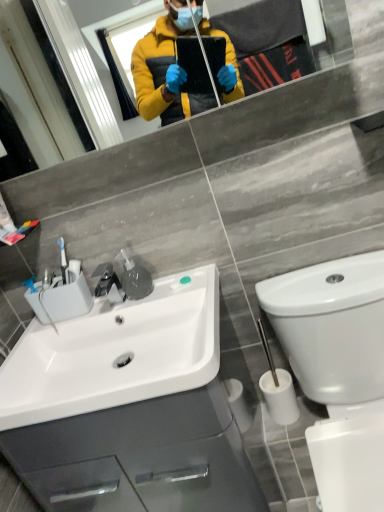
Question: From a real-world perspective, is white glossy toilet at lower right physically below white glossy sink at lower left?

Choices:
 (A) no
 (B) yes

Answer: (B)

Question: From a real-world perspective, is white glossy toilet at lower right positioned over white glossy sink at lower left based on gravity?

Choices:
 (A) no
 (B) yes

Answer: (A)

Question: Is white glossy toilet at lower right beside white glossy sink at lower left?

Choices:
 (A) yes
 (B) no

Answer: (B)

Question: Does white glossy toilet at lower right appear on the right side of white glossy sink at lower left?

Choices:
 (A) yes
 (B) no

Answer: (A)

Question: From the image's perspective, is white glossy toilet at lower right below white glossy sink at lower left?

Choices:
 (A) no
 (B) yes

Answer: (B)

Question: Considering the positions of point (177, 380) and point (354, 345), is point (177, 380) closer or farther from the camera than point (354, 345)?

Choices:
 (A) farther
 (B) closer

Answer: (B)

Question: Relative to white glossy toilet at lower right, is white glossy sink at lower left in front or behind?

Choices:
 (A) behind
 (B) front

Answer: (A)

Question: Visually, is white glossy sink at lower left positioned to the left or to the right of white glossy toilet at lower right?

Choices:
 (A) right
 (B) left

Answer: (B)

Question: In terms of height, does white glossy sink at lower left look taller or shorter compared to white glossy toilet at lower right?

Choices:
 (A) short
 (B) tall

Answer: (A)

Question: Based on their sizes in the image, would you say white glossy cabinet at lower left is bigger or smaller than white glossy sink at lower left?

Choices:
 (A) big
 (B) small

Answer: (A)

Question: Is white glossy cabinet at lower left in front of or behind white glossy sink at lower left in the image?

Choices:
 (A) behind
 (B) front

Answer: (A)

Question: Considering the positions of white glossy cabinet at lower left and white glossy sink at lower left in the image, is white glossy cabinet at lower left taller or shorter than white glossy sink at lower left?

Choices:
 (A) short
 (B) tall

Answer: (B)

Question: Based on their positions, is white glossy cabinet at lower left located to the left or right of white glossy sink at lower left?

Choices:
 (A) left
 (B) right

Answer: (B)

Question: Based on their sizes in the image, would you say matte glass mirror at upper center is bigger or smaller than white glossy cabinet at lower left?

Choices:
 (A) small
 (B) big

Answer: (A)

Question: From the image's perspective, is matte glass mirror at upper center located above or below white glossy cabinet at lower left?

Choices:
 (A) below
 (B) above

Answer: (B)